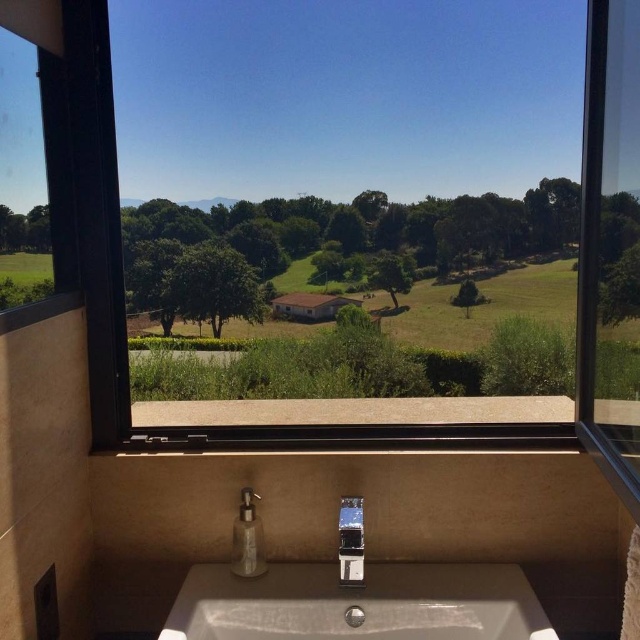
Question: Does transparent glass window at center appear on the left side of satin nickel faucet at center?

Choices:
 (A) yes
 (B) no

Answer: (A)

Question: Based on their relative distances, which object is nearer to the transparent glass window at upper left?

Choices:
 (A) white ceramic sink at lower center
 (B) transparent glass window at center

Answer: (B)

Question: Where is white ceramic sink at lower center located in relation to satin nickel faucet at center in the image?

Choices:
 (A) right
 (B) left

Answer: (A)

Question: Among these objects, which one is farthest from the camera?

Choices:
 (A) transparent glass window at center
 (B) satin nickel faucet at center
 (C) transparent glass window at upper left

Answer: (B)

Question: Is transparent glass window at center below transparent glass window at upper left?

Choices:
 (A) no
 (B) yes

Answer: (B)

Question: Which point appears closest to the camera in this image?

Choices:
 (A) (35, 237)
 (B) (349, 531)
 (C) (600, 145)
 (D) (387, 611)

Answer: (A)